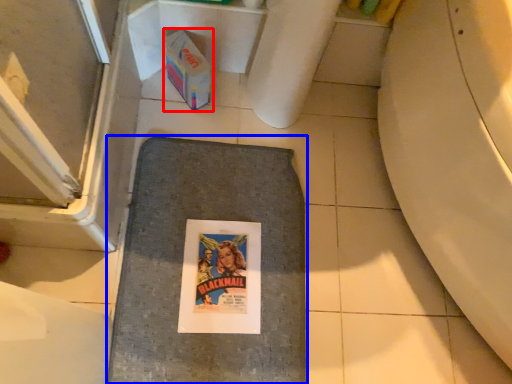
Question: Among these objects, which one is nearest to the camera, cardboard box (highlighted by a red box) or bath mat (highlighted by a blue box)?

Choices:
 (A) cardboard box
 (B) bath mat

Answer: (B)